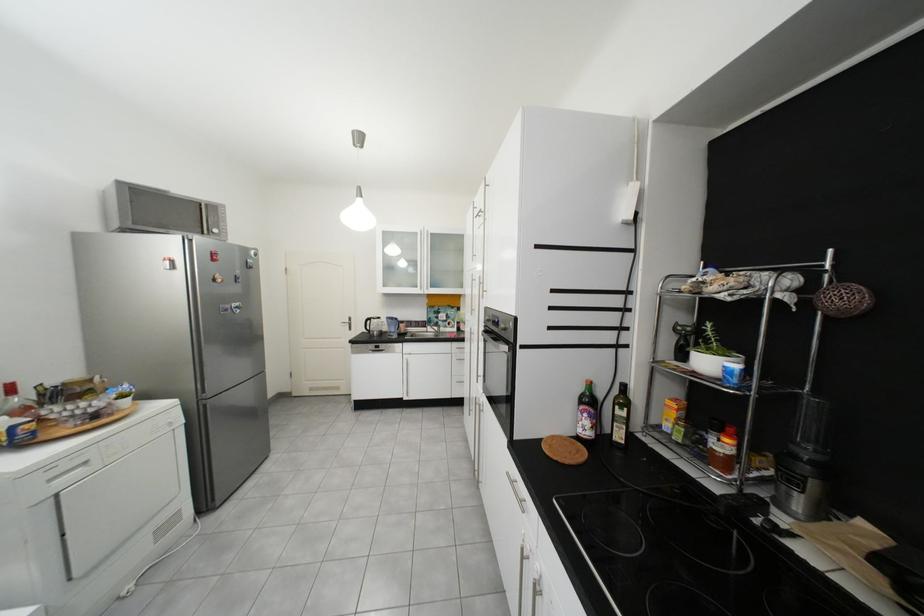
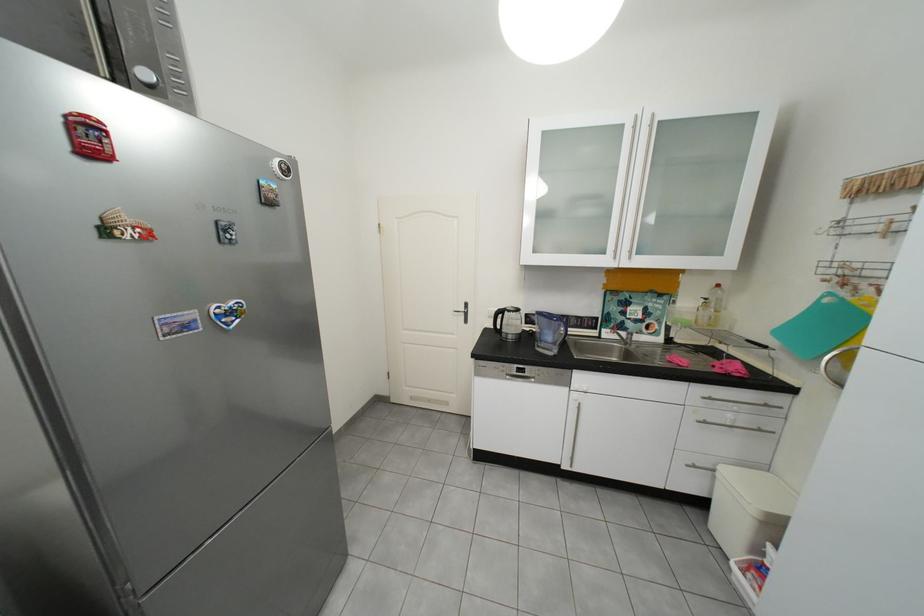
Where in the second image is the point corresponding to pixel 226 232 from the first image?

(156, 75)